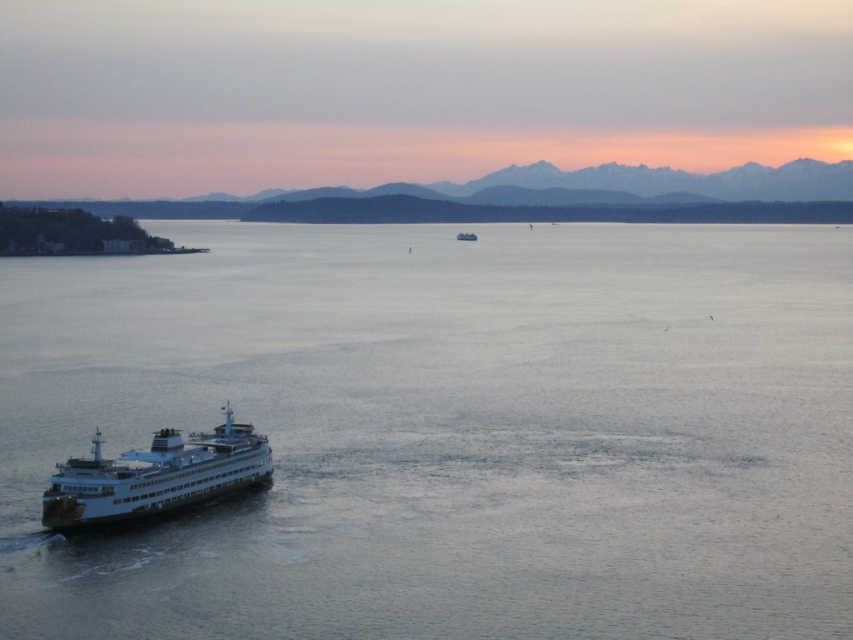
Question: Which of the following is the farthest from the observer?

Choices:
 (A) (463, 237)
 (B) (10, 342)

Answer: (A)

Question: Among these objects, which one is nearest to the camera?

Choices:
 (A) sandy brown mountains at upper center
 (B) white matte ferry at center
 (C) clear water at center
 (D) white glossy ferry at lower left

Answer: (C)

Question: Can you confirm if sandy brown mountains at upper center is positioned below white matte ferry at center?

Choices:
 (A) no
 (B) yes

Answer: (A)

Question: Is sandy brown mountains at upper center to the right of white glossy ferry at lower left from the viewer's perspective?

Choices:
 (A) no
 (B) yes

Answer: (B)

Question: Does clear water at center have a lesser width compared to white glossy ferry at lower left?

Choices:
 (A) no
 (B) yes

Answer: (A)

Question: Estimate the real-world distances between objects in this image. Which object is closer to the sandy brown mountains at upper center?

Choices:
 (A) white matte ferry at center
 (B) clear water at center
 (C) white glossy ferry at lower left

Answer: (A)